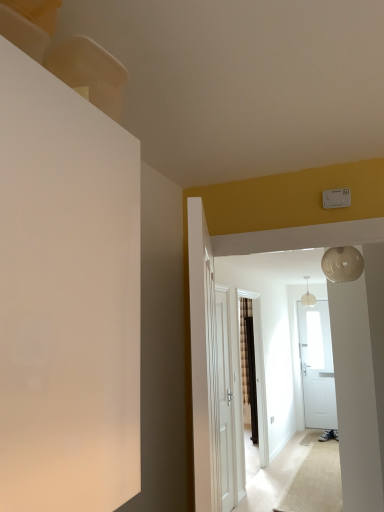
Question: Would you say pearl white glass globe at upper right is to the left or to the right of white wooden door at center, marked as the 1th door in a right-to-left arrangement, in the picture?

Choices:
 (A) left
 (B) right

Answer: (B)

Question: From the image's perspective, is pearl white glass globe at upper right positioned above or below white wooden door at center, the second door from the left?

Choices:
 (A) above
 (B) below

Answer: (A)

Question: Which object is positioned farthest from the pearl white glass globe at upper center?

Choices:
 (A) white wooden door at center, the 1th door when ordered from left to right
 (B) white wooden door at center, the 2th door viewed from the front
 (C) pearl white glass globe at upper right

Answer: (C)

Question: Considering the real-world distances, which object is farthest from the white wooden door at center, the 1th door when ordered from left to right?

Choices:
 (A) pearl white glass globe at upper center
 (B) pearl white glass globe at upper right
 (C) white wooden door at center, marked as the 1th door in a right-to-left arrangement

Answer: (A)